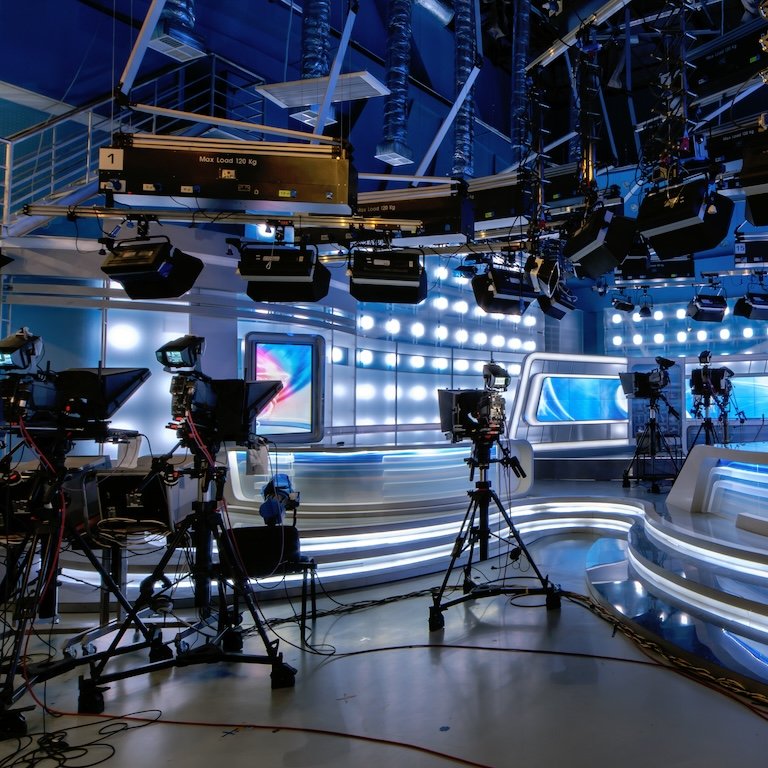
You are a GUI agent. You are given a task and a screenshot of the screen. Output one action in this format:
    pyautogui.click(x=<x>, y=<y>)
    Task: Click on the overhead lights
    
    Given the screenshot: What is the action you would take?
    pyautogui.click(x=166, y=275), pyautogui.click(x=290, y=280), pyautogui.click(x=402, y=286), pyautogui.click(x=505, y=299), pyautogui.click(x=703, y=230), pyautogui.click(x=709, y=296), pyautogui.click(x=752, y=299), pyautogui.click(x=647, y=269), pyautogui.click(x=629, y=300), pyautogui.click(x=649, y=310)